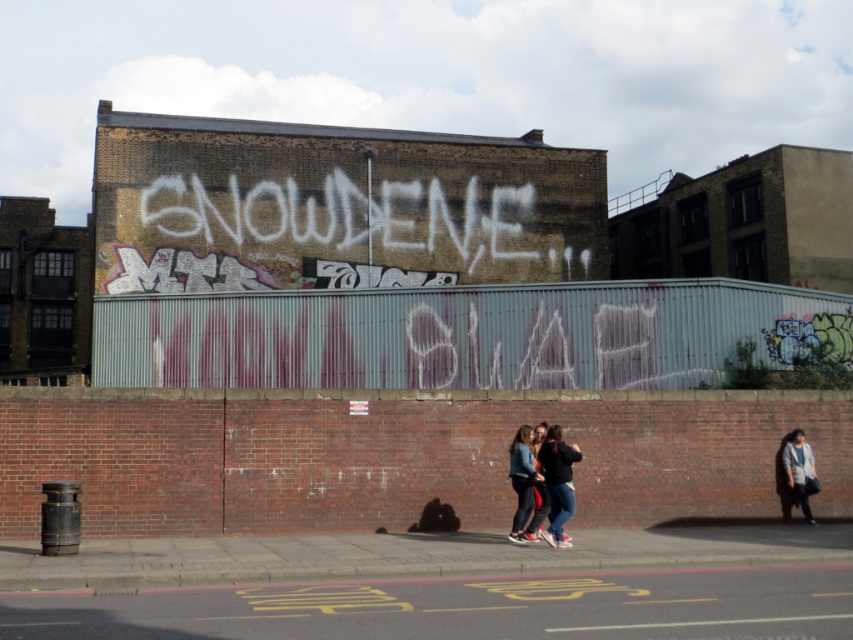
You are a street artist who wants to place a new sticker on the jacket that is larger in size. Which jacket should you choose between the denim jacket at center and the dark gray jacket at right?

The dark gray jacket at right is larger in size compared to the denim jacket at center, so you should choose the dark gray jacket at right to place the new sticker.

You are standing in front of the brick wall with graffiti. You see a denim jacket at center and a dark gray jacket at right. Which jacket is nearer to you?

The denim jacket at center is closer to the viewer than the dark gray jacket at right.